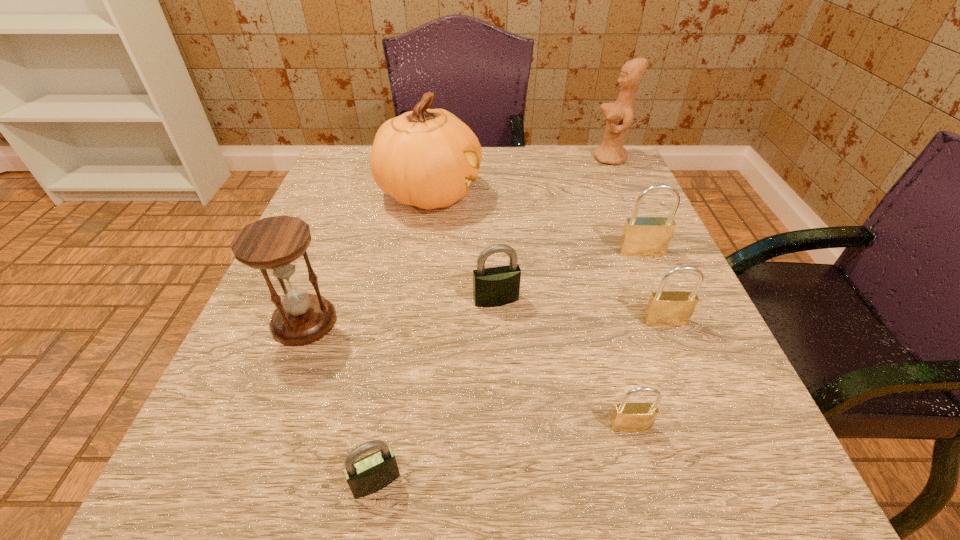
This screenshot has height=540, width=960. What are the coordinates of `the nearer black padlock` in the screenshot? It's located at (374, 472).

The height and width of the screenshot is (540, 960). In order to click on the second nearest object in this screenshot , I will do `click(627, 417)`.

Locate an element on the screen. the third padlock from right to left is located at coordinates click(x=627, y=417).

The height and width of the screenshot is (540, 960). What are the coordinates of `vacant space situated on the front-facing side of the figurine` in the screenshot? It's located at (475, 158).

Identify the location of free space located 0.400m on the front-facing side of the figurine. (436, 158).

Locate an element on the screen. Image resolution: width=960 pixels, height=540 pixels. vacant space located 0.250m on the front-facing side of the figurine is located at coordinates (494, 158).

Find the location of `vacant point located 0.150m on the front face of the pumpkin`. vacant point located 0.150m on the front face of the pumpkin is located at coordinates (548, 194).

The image size is (960, 540). In order to click on vacant space located 0.240m on the front of the leftmost object in this screenshot , I will do `click(231, 512)`.

Identify the location of free space located 0.140m on the front-facing side of the fourth tallest object. This screenshot has width=960, height=540. (666, 311).

This screenshot has height=540, width=960. Find the location of `vacant point located on the back of the second farthest padlock`. vacant point located on the back of the second farthest padlock is located at coordinates (493, 239).